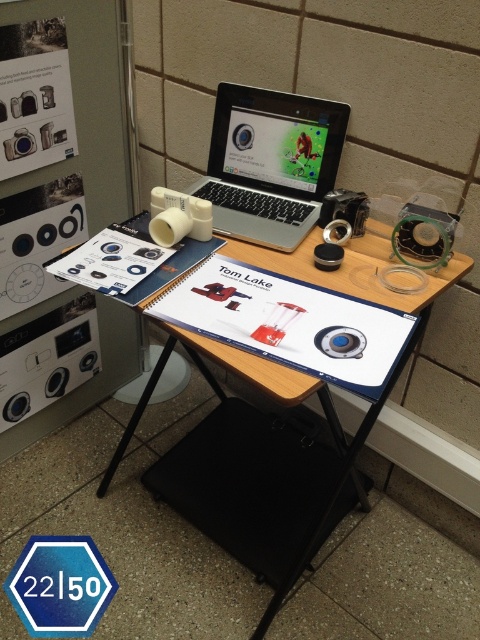
Measure the distance from silver metallic laptop at center to black plastic speaker at center.

silver metallic laptop at center and black plastic speaker at center are 18.87 centimeters apart.

Does silver metallic laptop at center come behind black plastic speaker at center?

No, silver metallic laptop at center is closer to the viewer.

Does point (242, 141) lie in front of point (321, 218)?

No, (242, 141) is behind (321, 218).

Identify the location of silver metallic laptop at center. This screenshot has width=480, height=640. (271, 163).

Does wooden table at center have a lesser height compared to silver metallic laptop at center?

No.

Which is more to the right, wooden table at center or silver metallic laptop at center?

From the viewer's perspective, silver metallic laptop at center appears more on the right side.

Where is `wooden table at center`? The width and height of the screenshot is (480, 640). wooden table at center is located at coordinates (262, 458).

Is point (43, 600) more distant than point (361, 216)?

Yes, point (43, 600) is farther from viewer.

Is blue hexagonal stop sign at center wider than black plastic speaker at center?

Yes.

Is point (25, 582) less distant than point (358, 230)?

No, it is not.

Locate an element on the screen. This screenshot has height=640, width=480. blue hexagonal stop sign at center is located at coordinates (60, 586).